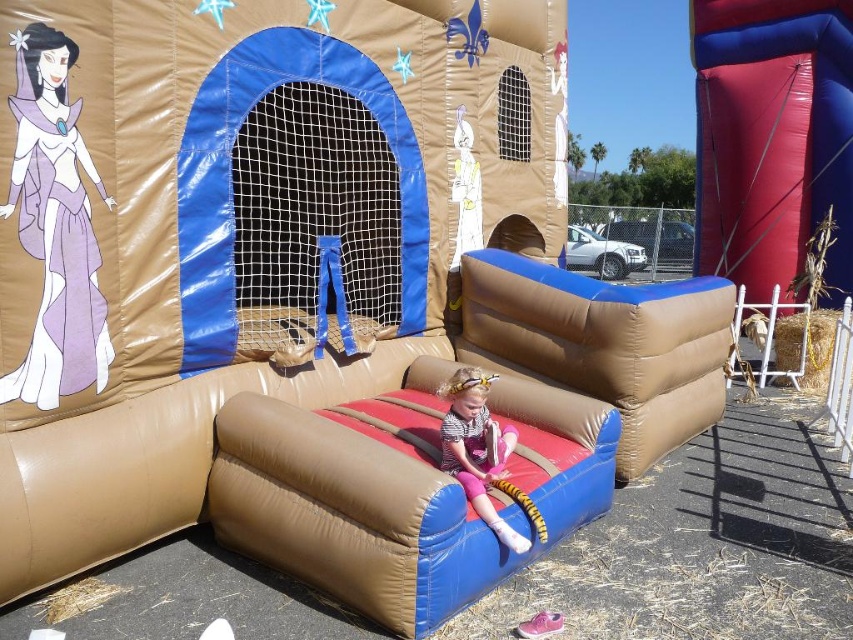
Question: Which point is closer to the camera?

Choices:
 (A) smooth red slide at right
 (B) matte pink leggings at center
 (C) purple satin dress at upper left

Answer: (C)

Question: Can you confirm if purple satin dress at upper left is bigger than matte pink leggings at center?

Choices:
 (A) yes
 (B) no

Answer: (B)

Question: Is smooth red slide at right smaller than purple satin dress at upper left?

Choices:
 (A) yes
 (B) no

Answer: (B)

Question: Does smooth red slide at right have a greater width compared to purple satin dress at upper left?

Choices:
 (A) yes
 (B) no

Answer: (A)

Question: Which of these objects is positioned closest to the smooth red slide at right?

Choices:
 (A) purple satin dress at upper left
 (B) matte pink leggings at center

Answer: (B)

Question: Which object is positioned closest to the smooth red slide at right?

Choices:
 (A) matte pink leggings at center
 (B) purple satin dress at upper left

Answer: (A)